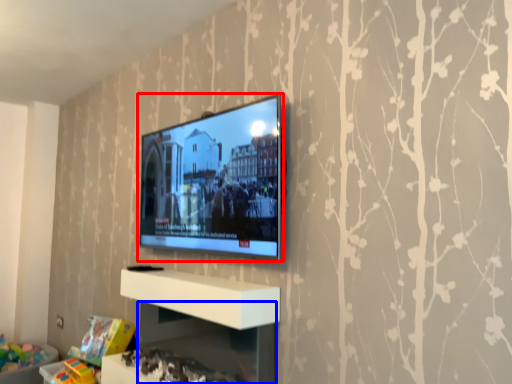
Question: Which object appears farthest to the camera in this image, television (highlighted by a red box) or shelf (highlighted by a blue box)?

Choices:
 (A) television
 (B) shelf

Answer: (A)